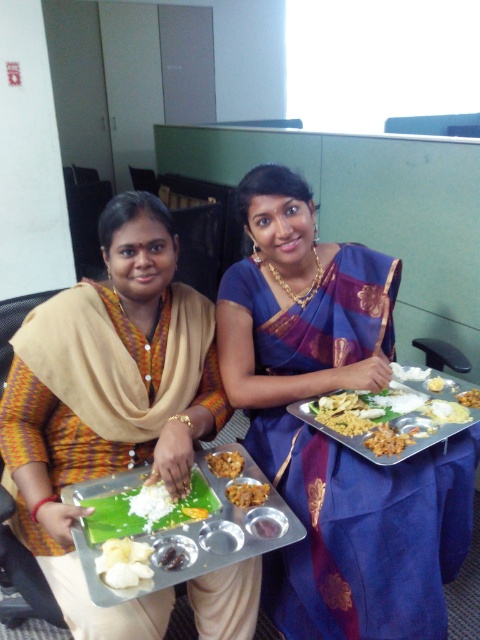
Between white matte banana at center and brown crumbly snack at center, which one is positioned lower?

white matte banana at center is lower down.

Describe the element at coordinates (123, 563) in the screenshot. I see `white matte banana at center` at that location.

At what (x,y) coordinates should I click in order to perform the action: click on white matte banana at center. Please return your answer as a coordinate pair (x, y). This screenshot has height=640, width=480. Looking at the image, I should click on (123, 563).

Can you confirm if blue silk saree at center is positioned to the right of white matte rice at center?

Correct, you'll find blue silk saree at center to the right of white matte rice at center.

In the scene shown: Which of these two, blue silk saree at center or white matte rice at center, stands taller?

With more height is blue silk saree at center.

Where is `blue silk saree at center`? blue silk saree at center is located at coordinates (333, 440).

Looking at this image, can you confirm if brown matte rice at center is wider than white matte rice at center?

Yes, brown matte rice at center is wider than white matte rice at center.

Is point (367, 445) more distant than point (159, 556)?

Yes, point (367, 445) is behind point (159, 556).

Between point (393, 438) and point (165, 566), which one is positioned behind?

The point (393, 438) is more distant.

The image size is (480, 640). Identify the location of brown matte rice at center. (386, 440).